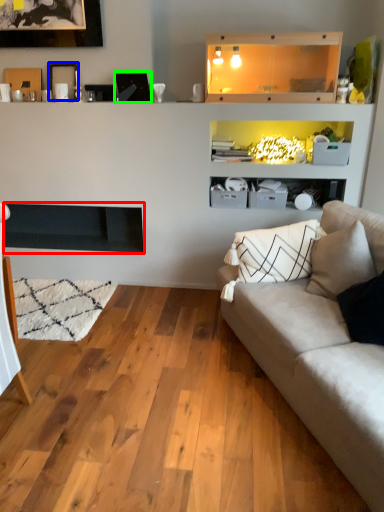
Question: Considering the real-world distances, which object is farthest from fireplace (highlighted by a red box)? picture frame (highlighted by a blue box) or picture frame (highlighted by a green box)?

Choices:
 (A) picture frame
 (B) picture frame

Answer: (B)